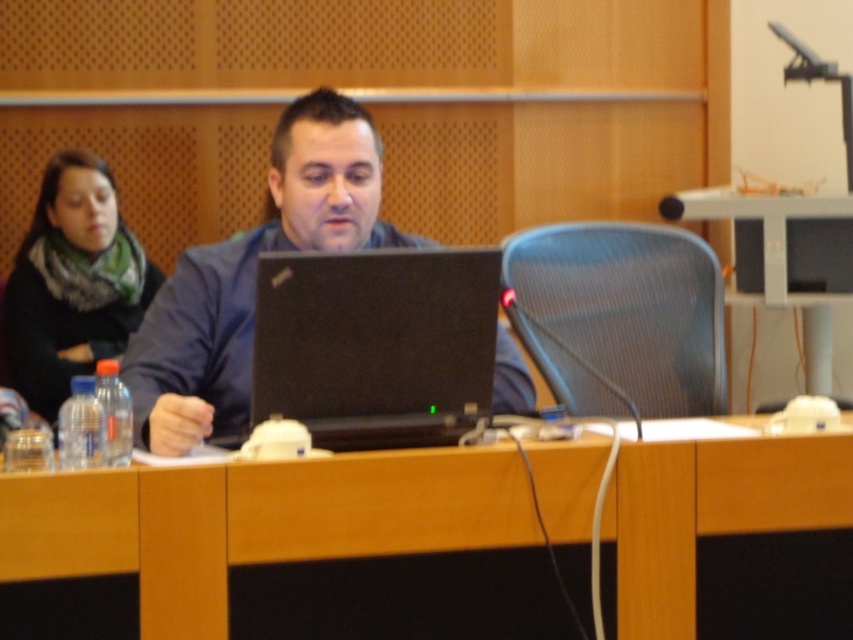
Is wooden table at center shorter than black knit scarf at left?

Yes, wooden table at center is shorter than black knit scarf at left.

Can you confirm if wooden table at center is positioned above black knit scarf at left?

Incorrect, wooden table at center is not positioned above black knit scarf at left.

The image size is (853, 640). What are the coordinates of `wooden table at center` in the screenshot? It's located at (254, 522).

Who is more forward, (x=18, y=365) or (x=755, y=246)?

Positioned in front is point (x=18, y=365).

Measure the distance from black knit scarf at left to metallic silver table at center.

They are 7.38 feet apart.

The height and width of the screenshot is (640, 853). Describe the element at coordinates (73, 282) in the screenshot. I see `black knit scarf at left` at that location.

Image resolution: width=853 pixels, height=640 pixels. I want to click on black knit scarf at left, so click(73, 282).

Who is higher up, matte black laptop at center or metallic silver table at center?

metallic silver table at center is above.

Is point (321, 125) positioned after point (851, 202)?

That is False.

You are a GUI agent. You are given a task and a screenshot of the screen. Output one action in this format:
    pyautogui.click(x=<x>, y=<y>)
    Task: Click on the matte black laptop at center
    This screenshot has width=853, height=640.
    Given the screenshot: What is the action you would take?
    pyautogui.click(x=253, y=275)